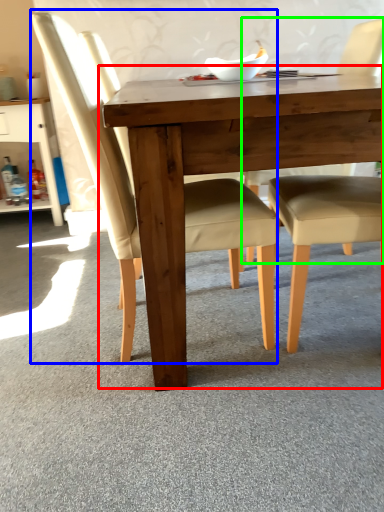
Question: Considering the real-world distances, which object is farthest from table (highlighted by a red box)? chair (highlighted by a blue box) or chair (highlighted by a green box)?

Choices:
 (A) chair
 (B) chair

Answer: (B)